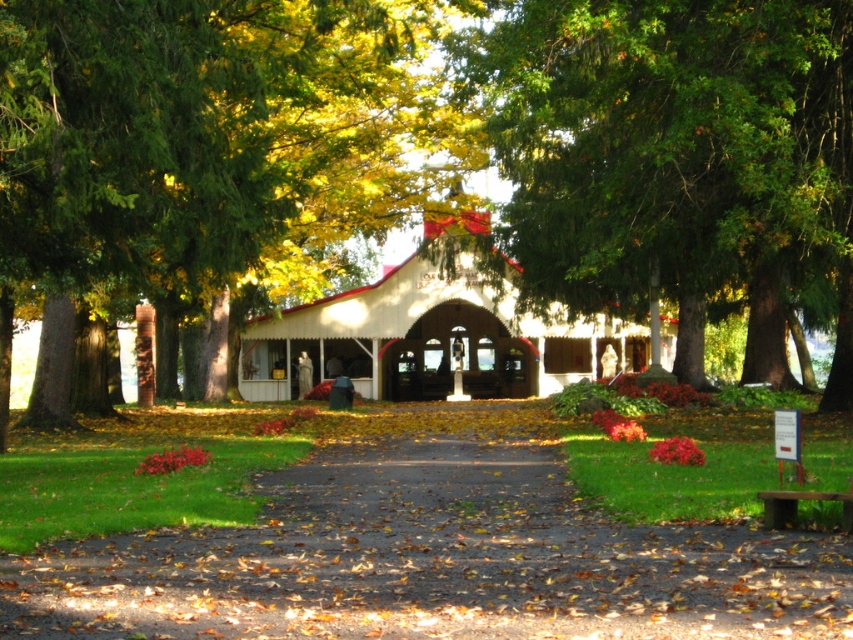
You are planning to walk from the brown dirt path at center to the white wood chapel at center. Which direction should you move relative to the chapel to reach the path?

The brown dirt path at center is positioned on the left side of the white wood chapel at center, so to reach the path from the chapel, you should move to the left side of the chapel.

In the scene shown: You are planning to walk from the brown dirt path at center to the white wood chapel at center. Based on the scene description, which direction should you head to reach the chapel from the path?

The brown dirt path at center is located below the white wood chapel at center, so you should head upwards from the path to reach the chapel.

You are planning to take a photo of the green leafy tree at center and the brown dirt path at center from a position near the rustic building. Which object will appear larger in your photo?

The green leafy tree at center will appear larger in the photo because it is bigger than the brown dirt path at center.